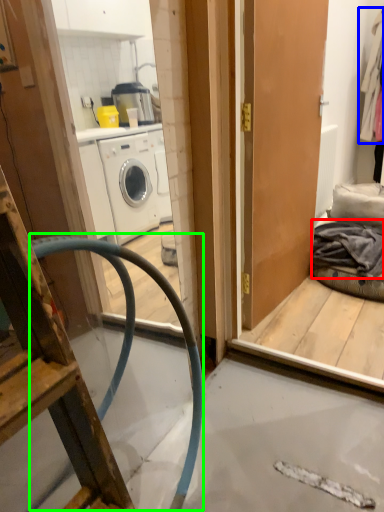
Question: Which object is positioned closest to clothing (highlighted by a red box)? Select from clothing (highlighted by a blue box) and garden hose (highlighted by a green box).

Choices:
 (A) clothing
 (B) garden hose

Answer: (B)